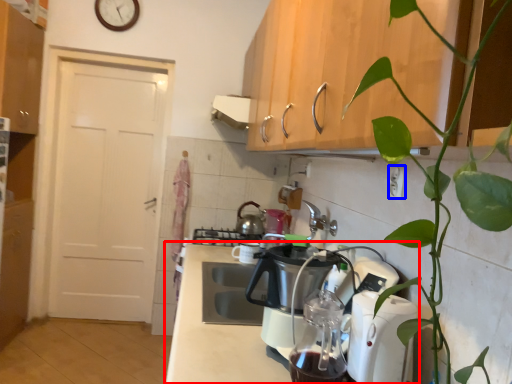
Question: Which object is further to the camera taking this photo, countertop (highlighted by a red box) or electric outlet (highlighted by a blue box)?

Choices:
 (A) countertop
 (B) electric outlet

Answer: (B)